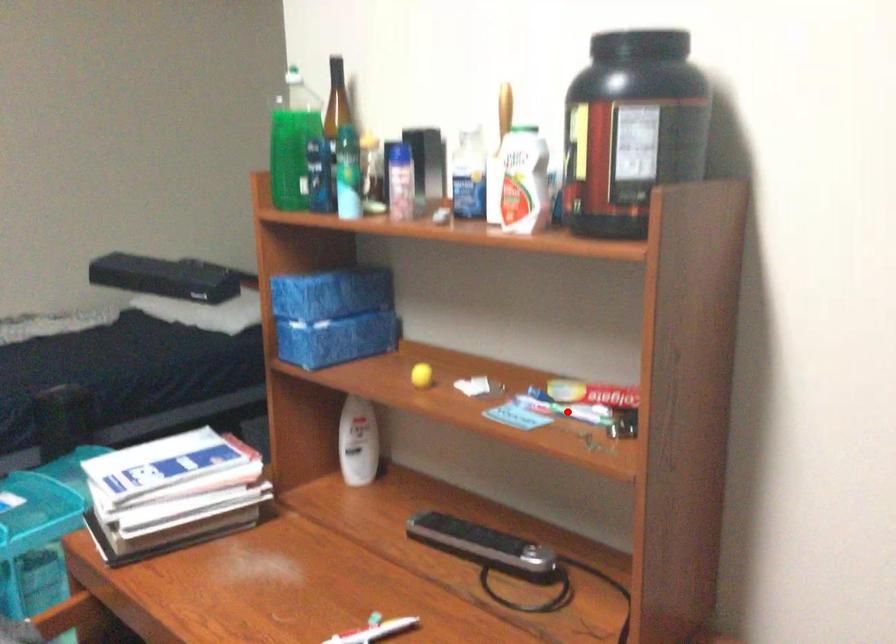
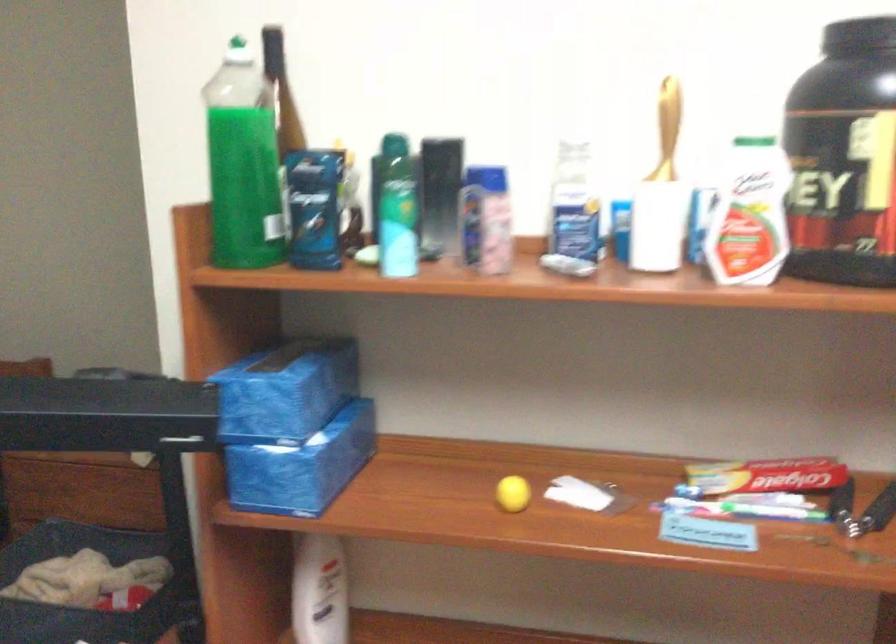
Question: I am providing you with two images of the same scene from different viewpoints. Given a red point in image1, look at the same physical point in image2. Is it:

Choices:
 (A) Closer to the viewpoint
 (B) Farther from the viewpoint

Answer: (A)